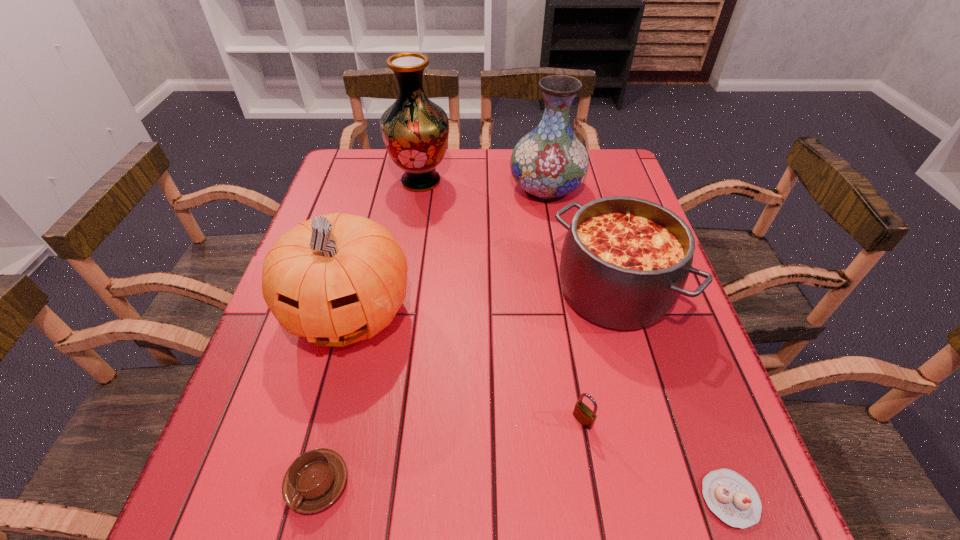
Find the location of a particular element. This screenshot has height=540, width=960. the left vase is located at coordinates (415, 130).

This screenshot has width=960, height=540. I want to click on the right vase, so click(x=549, y=162).

The image size is (960, 540). Find the location of `pumpkin`. pumpkin is located at coordinates (336, 279).

I want to click on the fourth shortest object, so click(x=624, y=263).

Where is `the fifth farthest object`? This screenshot has height=540, width=960. the fifth farthest object is located at coordinates (585, 416).

I want to click on padlock, so click(x=585, y=416).

This screenshot has height=540, width=960. I want to click on the sixth tallest object, so click(315, 479).

Find the location of `the shortest object`. the shortest object is located at coordinates (731, 497).

Identify the location of vacant region located on the right of the left vase. Image resolution: width=960 pixels, height=540 pixels. [562, 181].

Locate an element on the screen. free space located on the right of the right vase is located at coordinates (613, 188).